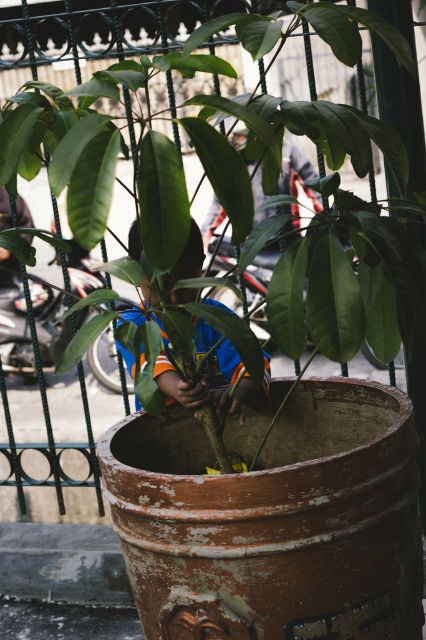
You are trying to determine if the green matte pot at center can fit through a narrow doorway that is the same width as the blue jersey at center. Based on the scene, can the pot pass through?

The green matte pot at center is wider than the blue jersey at center, so it cannot pass through the doorway that is the same width as the blue jersey at center.

You are standing in a garden and see the green matte pot at center and the blue jersey at center. Which object is positioned higher from the ground?

The green matte pot at center is above blue jersey at center, so the green matte pot at center is higher from the ground.

You are a delivery person trying to deliver a package to the address shown in the image. You need to place the package on the green matte pot at center or the blue jersey at center. Which object can you place the package on without it falling over?

The green matte pot at center is taller than the blue jersey at center, so placing the package on the green matte pot at center would be more stable and less likely to fall over.